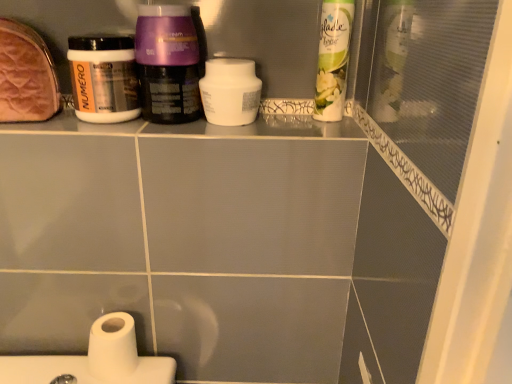
Question: Considering the relative sizes of white glossy air freshener at upper right, which is the first cleaning product from right to left, and white matte toilet paper at lower left in the image provided, is white glossy air freshener at upper right, which is the first cleaning product from right to left, bigger than white matte toilet paper at lower left?

Choices:
 (A) no
 (B) yes

Answer: (B)

Question: Are white glossy air freshener at upper right, which is the first cleaning product from right to left, and white matte toilet paper at lower left making contact?

Choices:
 (A) yes
 (B) no

Answer: (B)

Question: Considering the relative sizes of white glossy air freshener at upper right, the second cleaning product when ordered from left to right, and white matte toilet paper at lower left in the image provided, is white glossy air freshener at upper right, the second cleaning product when ordered from left to right, smaller than white matte toilet paper at lower left?

Choices:
 (A) yes
 (B) no

Answer: (B)

Question: Does white glossy air freshener at upper right, which is the first cleaning product from right to left, have a lesser width compared to white matte toilet paper at lower left?

Choices:
 (A) yes
 (B) no

Answer: (A)

Question: Does white glossy air freshener at upper right, the second cleaning product when ordered from left to right, have a lesser height compared to white matte toilet paper at lower left?

Choices:
 (A) no
 (B) yes

Answer: (A)

Question: Would you say leather-like brown pouch at upper left is to the left or to the right of white glossy air freshener at upper right, the second cleaning product when ordered from left to right, in the picture?

Choices:
 (A) left
 (B) right

Answer: (A)

Question: Is leather-like brown pouch at upper left wider or thinner than white glossy air freshener at upper right, the second cleaning product when ordered from left to right?

Choices:
 (A) wide
 (B) thin

Answer: (A)

Question: Is leather-like brown pouch at upper left spatially inside white glossy air freshener at upper right, which is the first cleaning product from right to left, or outside of it?

Choices:
 (A) inside
 (B) outside

Answer: (B)

Question: Considering the positions of point (31, 41) and point (350, 33), is point (31, 41) closer or farther from the camera than point (350, 33)?

Choices:
 (A) farther
 (B) closer

Answer: (B)

Question: Is leather-like brown pouch at upper left bigger or smaller than white matte jar at center, placed as the first cleaning product when sorted from left to right?

Choices:
 (A) small
 (B) big

Answer: (B)

Question: Is leather-like brown pouch at upper left to the left or to the right of white matte jar at center, placed as the first cleaning product when sorted from left to right, in the image?

Choices:
 (A) left
 (B) right

Answer: (A)

Question: Is leather-like brown pouch at upper left taller or shorter than white matte jar at center, which is counted as the 2th cleaning product, starting from the right?

Choices:
 (A) short
 (B) tall

Answer: (B)

Question: From a real-world perspective, is leather-like brown pouch at upper left positioned above or below white matte jar at center, which is counted as the 2th cleaning product, starting from the right?

Choices:
 (A) below
 (B) above

Answer: (B)

Question: From a real-world perspective, is purple glossy cream at center, which is the 2th bottle in left-to-right order, above or below white glossy air freshener at upper right, which is the first cleaning product from right to left?

Choices:
 (A) below
 (B) above

Answer: (A)

Question: Is purple glossy cream at center, which is the 2th bottle in left-to-right order, bigger or smaller than white glossy air freshener at upper right, which is the first cleaning product from right to left?

Choices:
 (A) big
 (B) small

Answer: (A)